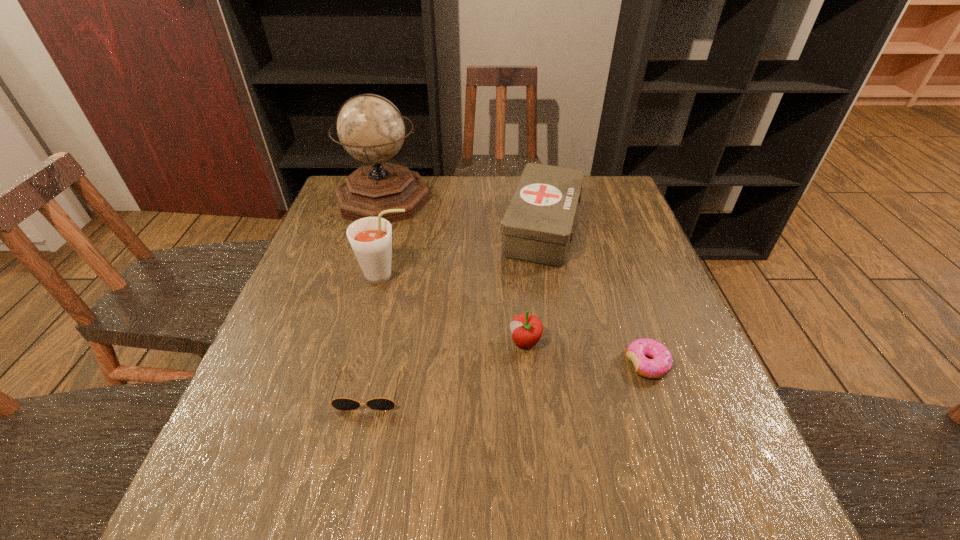
Identify the location of globe. pos(370,128).

Locate an element on the screen. The height and width of the screenshot is (540, 960). root beer is located at coordinates (370, 238).

The image size is (960, 540). In order to click on the third tallest object in this screenshot , I will do `click(537, 225)`.

Find the location of a particular element. the fourth tallest object is located at coordinates (527, 329).

Locate an element on the screen. This screenshot has width=960, height=540. sunglasses is located at coordinates (344, 404).

At what (x,y) coordinates should I click in order to perform the action: click on doughnut. Please return your answer as a coordinate pair (x, y). Looking at the image, I should click on (660, 364).

Where is `free space located on the surface of the globe`? This screenshot has width=960, height=540. free space located on the surface of the globe is located at coordinates (361, 273).

The width and height of the screenshot is (960, 540). What are the coordinates of `free spot located 0.260m on the drink side of the root beer` in the screenshot? It's located at (516, 276).

Find the location of a particular element. The height and width of the screenshot is (540, 960). free region located 0.150m on the front of the first-aid kit is located at coordinates (558, 312).

Find the location of a particular element. This screenshot has height=540, width=960. vacant space located on the back of the fourth tallest object is located at coordinates (520, 292).